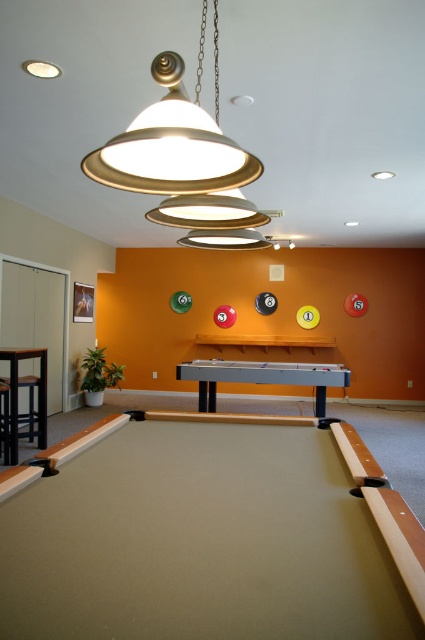
Question: Is beige felt pool table at center behind smooth gray pool table at center?

Choices:
 (A) no
 (B) yes

Answer: (A)

Question: From the image, what is the correct spatial relationship of smooth gray pool table at center in relation to black leather stool at lower left?

Choices:
 (A) right
 (B) left

Answer: (A)

Question: Does beige felt pool table at center appear on the right side of smooth gray pool table at center?

Choices:
 (A) yes
 (B) no

Answer: (B)

Question: Estimate the real-world distances between objects in this image. Which object is closer to the smooth gray pool table at center?

Choices:
 (A) beige felt pool table at center
 (B) black leather stool at lower left

Answer: (B)

Question: Among these points, which one is nearest to the camera?

Choices:
 (A) (257, 625)
 (B) (13, 387)

Answer: (A)

Question: Which point appears farthest from the camera in this image?

Choices:
 (A) (74, 593)
 (B) (328, 365)

Answer: (B)